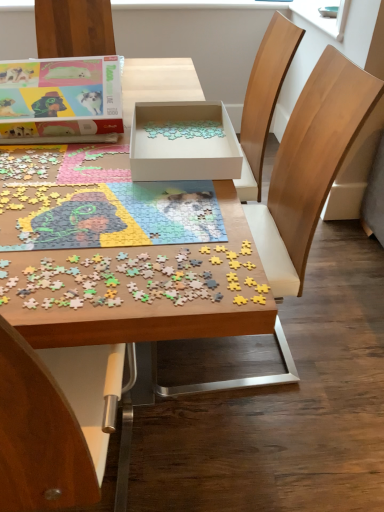
Find the location of `vacant area that lies to the right of wooden chair at center`. vacant area that lies to the right of wooden chair at center is located at coordinates (337, 347).